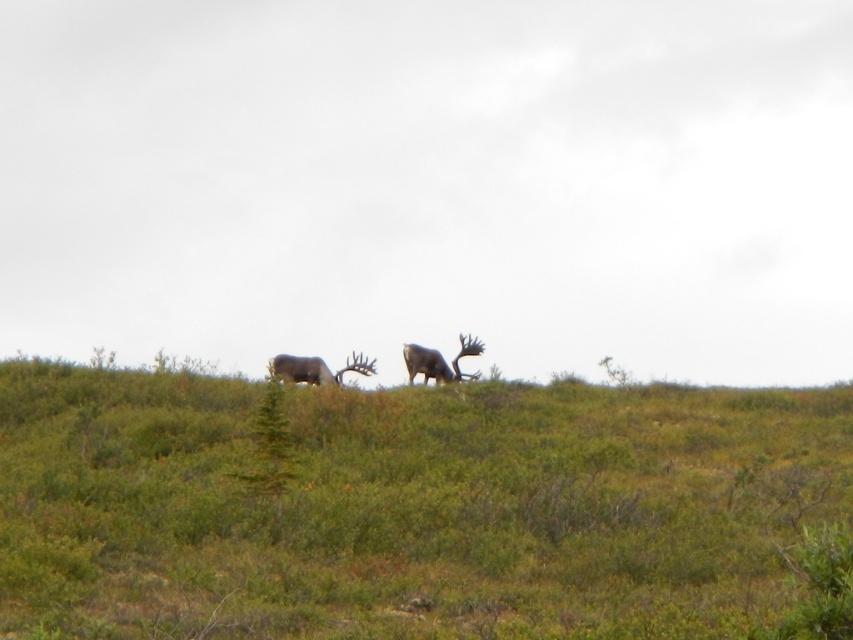
You are standing at the origin point in the image and want to walk to the green grassy hillside at center. Which direction should you head towards?

The green grassy hillside at center is located at point 0.795 on the x and 0.478 on the y axis, so you should head towards the right and slightly forward to reach it.

You are standing at the base of the hill and want to reach the top of the green grassy hillside at center. If your average walking pace is 3 feet per second, how long will it take you to reach the top?

The distance to the top of the green grassy hillside at center is 21.07 feet. At a pace of 3 feet per second, it would take approximately 7.02 seconds to reach the top.